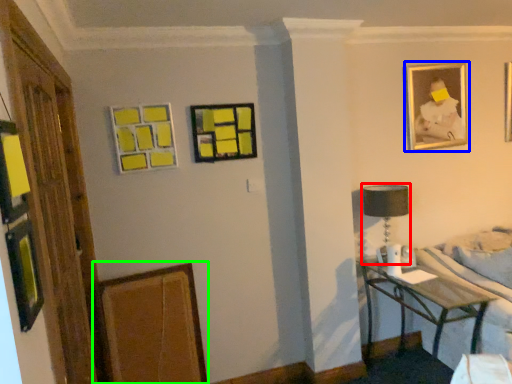
Question: Based on their relative distances, which object is farther from table lamp (highlighted by a red box)? Choose from picture frame (highlighted by a blue box) and picture frame (highlighted by a green box).

Choices:
 (A) picture frame
 (B) picture frame

Answer: (B)